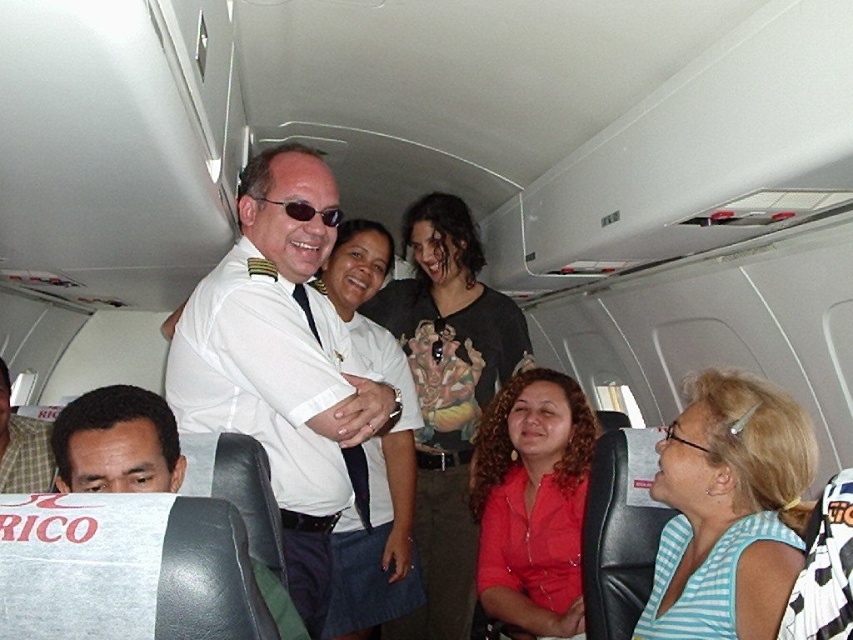
You are a flight attendant observing the passengers. You notice a passenger wearing a matte white shirt at lower left and another passenger with a smooth skin face at lower left. Which object is positioned lower in the image?

The matte white shirt at lower left is positioned below the smooth skin face at lower left, so the matte white shirt at lower left is lower in the image.

You are a flight attendant standing at the back of the airplane cabin. You need to quickly reach the brushed metal water at bottle left to serve a passenger. Is the white uniform at center blocking your path to the bottle?

The white uniform at center is in front of the brushed metal water at bottle left, so the white uniform at center is blocking the path to the bottle. You will need to move around or ask the person in the white uniform at center to step aside.

You are a flight attendant needing to hand out a snack pack to both the matte red shirt at center and the smooth skin face at lower left. The snack pack requires a 30 cm wide space to be placed. Can you fit both snack packs on the seat armrest between them?

The matte red shirt at center is wider than the smooth skin face at lower left. However, the exact widths aren